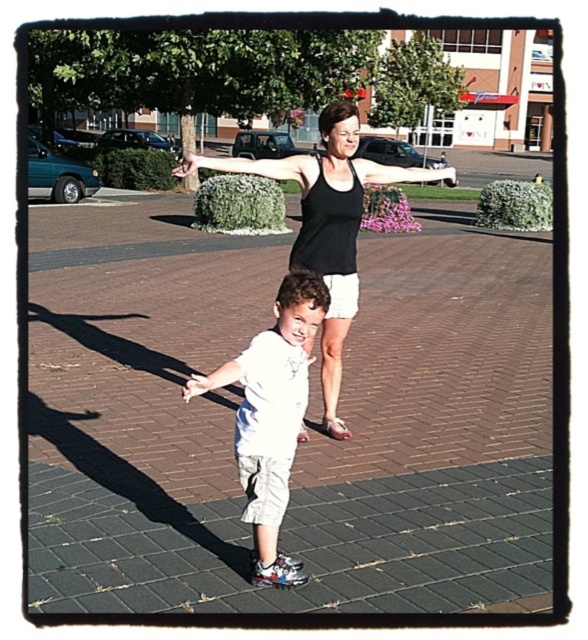
From the picture: Which is more to the left, black tank top at center or white fabric arm at center?

white fabric arm at center

What do you see at coordinates (332, 243) in the screenshot? I see `black tank top at center` at bounding box center [332, 243].

Which is behind, point (305, 221) or point (182, 396)?

The point (182, 396) is more distant.

The image size is (588, 640). I want to click on black tank top at center, so (332, 243).

Is brick pavement at center positioned before white cotton shirt at center?

No, brick pavement at center is further to the viewer.

Does point (65, 346) come closer to viewer compared to point (276, 384)?

No, (65, 346) is behind (276, 384).

This screenshot has height=640, width=588. Find the location of `brick pavement at center`. brick pavement at center is located at coordinates (306, 416).

Locate an element on the screen. brick pavement at center is located at coordinates pos(306,416).

Based on the photo, is brick pavement at center above black matte tank top at upper center?

No, brick pavement at center is not above black matte tank top at upper center.

Measure the distance between brick pavement at center and camera.

brick pavement at center is 9.87 feet from camera.

At what (x,y) coordinates should I click in order to perform the action: click on brick pavement at center. Please return your answer as a coordinate pair (x, y). Looking at the image, I should click on (306, 416).